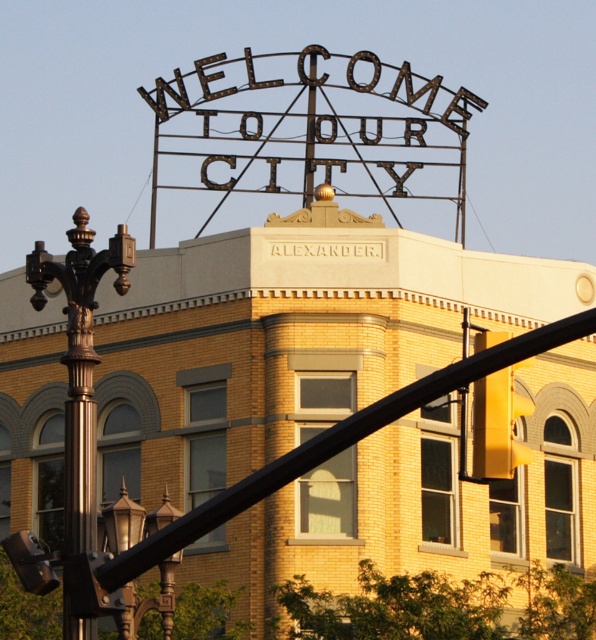
Question: Which of the following is the closest to the observer?

Choices:
 (A) (125, 620)
 (B) (488, 481)

Answer: (A)

Question: Considering the relative positions of polished bronze street light at left and bronze textured street light at lower left in the image provided, where is polished bronze street light at left located with respect to bronze textured street light at lower left?

Choices:
 (A) below
 (B) above

Answer: (B)

Question: Which of the following is the farthest from the observer?

Choices:
 (A) (166, 595)
 (B) (91, 308)

Answer: (A)

Question: Which is nearer to the yellow matte traffic light at center?

Choices:
 (A) polished bronze street light at left
 (B) bronze textured street light at lower left

Answer: (B)

Question: Is polished bronze street light at left thinner than bronze textured street light at lower left?

Choices:
 (A) no
 (B) yes

Answer: (B)

Question: Is polished bronze street light at left wider than yellow matte traffic light at center?

Choices:
 (A) yes
 (B) no

Answer: (A)